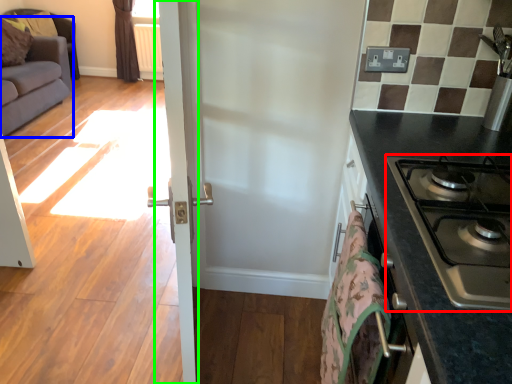
Question: Considering the real-world distances, which object is closest to gas stove (highlighted by a red box)? studio couch (highlighted by a blue box) or screen door (highlighted by a green box).

Choices:
 (A) studio couch
 (B) screen door

Answer: (B)